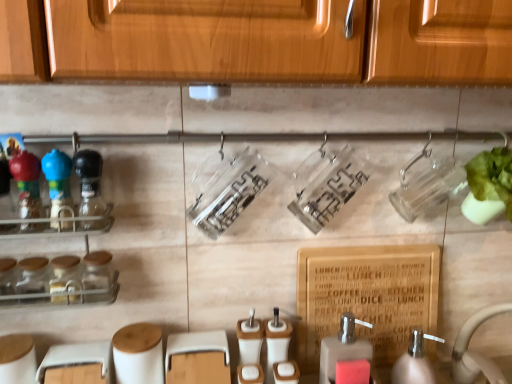
I want to click on matte brown soap dispenser at lower center, the 2th soap dispenser viewed from the right, so click(341, 346).

At what (x,y) coordinates should I click in order to perform the action: click on white plastic soap dispenser at lower right, arranged as the 1th soap dispenser when viewed from the right. Please return your answer as a coordinate pair (x, y). This screenshot has width=512, height=384. Looking at the image, I should click on (415, 361).

The height and width of the screenshot is (384, 512). What are the coordinates of `clear plastic container at center, which is counted as the 1th bottle, starting from the right` in the screenshot? It's located at (227, 190).

What do you see at coordinates (227, 190) in the screenshot?
I see `clear plastic container at center, marked as the 3th bottle in a left-to-right arrangement` at bounding box center [227, 190].

What are the coordinates of `blue glossy bottle at left, which is the 3th bottle in right-to-left order` in the screenshot? It's located at (58, 182).

At what (x,y) coordinates should I click in order to perform the action: click on matte black bottle at left, the 2th bottle when ordered from right to left. Please return your answer as a coordinate pair (x, y). Image resolution: width=512 pixels, height=384 pixels. Looking at the image, I should click on (89, 182).

You are a GUI agent. You are given a task and a screenshot of the screen. Output one action in this format:
    pyautogui.click(x=<x>, y=<y>)
    Task: Click on the green leafy vegetable at right
    The image size is (512, 384).
    Given the screenshot: What is the action you would take?
    pyautogui.click(x=489, y=185)

From a real-world perspective, is white plastic soap dispenser at lower right, which appears as the 2th soap dispenser when viewed from the left, on matte brown soap dispenser at lower center, the 2th soap dispenser viewed from the right?

No, from a real-world perspective, white plastic soap dispenser at lower right, which appears as the 2th soap dispenser when viewed from the left, is not on top of matte brown soap dispenser at lower center, the 2th soap dispenser viewed from the right.

You are a GUI agent. You are given a task and a screenshot of the screen. Output one action in this format:
    pyautogui.click(x=<x>, y=<y>)
    Task: Click on the soap dispenser that is above the white plastic soap dispenser at lower right, which appears as the 2th soap dispenser when viewed from the left (from the image's perspective)
    
    Given the screenshot: What is the action you would take?
    pyautogui.click(x=341, y=346)

How different are the orientations of white plastic soap dispenser at lower right, arranged as the 1th soap dispenser when viewed from the right, and matte brown soap dispenser at lower center, the 2th soap dispenser viewed from the right, in degrees?

The facing directions of white plastic soap dispenser at lower right, arranged as the 1th soap dispenser when viewed from the right, and matte brown soap dispenser at lower center, the 2th soap dispenser viewed from the right, are 0.00191 degrees apart.

Which of these two, white plastic soap dispenser at lower right, arranged as the 1th soap dispenser when viewed from the right, or matte brown soap dispenser at lower center, which is counted as the first soap dispenser, starting from the left, is smaller?

matte brown soap dispenser at lower center, which is counted as the first soap dispenser, starting from the left.

Which object is positioned more to the right, white plastic soap dispenser at lower right, which appears as the 2th soap dispenser when viewed from the left, or clear plastic container at center, marked as the 3th bottle in a left-to-right arrangement?

white plastic soap dispenser at lower right, which appears as the 2th soap dispenser when viewed from the left, is more to the right.

Considering the relative sizes of white plastic soap dispenser at lower right, arranged as the 1th soap dispenser when viewed from the right, and clear plastic container at center, which is counted as the 1th bottle, starting from the right, in the image provided, is white plastic soap dispenser at lower right, arranged as the 1th soap dispenser when viewed from the right, taller than clear plastic container at center, which is counted as the 1th bottle, starting from the right,?

In fact, white plastic soap dispenser at lower right, arranged as the 1th soap dispenser when viewed from the right, may be shorter than clear plastic container at center, which is counted as the 1th bottle, starting from the right.

Can you see white plastic soap dispenser at lower right, which appears as the 2th soap dispenser when viewed from the left, touching clear plastic container at center, which is counted as the 1th bottle, starting from the right?

No, white plastic soap dispenser at lower right, which appears as the 2th soap dispenser when viewed from the left, is not touching clear plastic container at center, which is counted as the 1th bottle, starting from the right.

Who is bigger, white plastic soap dispenser at lower right, which appears as the 2th soap dispenser when viewed from the left, or clear plastic container at center, which is counted as the 1th bottle, starting from the right?

Bigger between the two is clear plastic container at center, which is counted as the 1th bottle, starting from the right.

From the image's perspective, is green leafy vegetable at right above or below clear glass spice rack at left?

Based on their image positions, green leafy vegetable at right is located above clear glass spice rack at left.

Is clear glass spice rack at left a part of green leafy vegetable at right?

No, clear glass spice rack at left is not surrounded by green leafy vegetable at right.

Locate an element on the screen. The image size is (512, 384). shelf in front of the green leafy vegetable at right is located at coordinates (57, 235).

Who is shorter, green leafy vegetable at right or clear glass spice rack at left?

With less height is green leafy vegetable at right.

In the scene shown: Is white ceramic sink at lower right far away from matte brown soap dispenser at lower center, which is counted as the first soap dispenser, starting from the left?

No, there isn't a large distance between white ceramic sink at lower right and matte brown soap dispenser at lower center, which is counted as the first soap dispenser, starting from the left.

From a real-world perspective, does white ceramic sink at lower right sit lower than matte brown soap dispenser at lower center, the 2th soap dispenser viewed from the right?

Actually, white ceramic sink at lower right is physically above matte brown soap dispenser at lower center, the 2th soap dispenser viewed from the right, in the real world.

Measure the distance between white ceramic sink at lower right and matte brown soap dispenser at lower center, which is counted as the first soap dispenser, starting from the left.

white ceramic sink at lower right is 7.40 inches from matte brown soap dispenser at lower center, which is counted as the first soap dispenser, starting from the left.

What's the angular difference between white ceramic sink at lower right and matte brown soap dispenser at lower center, which is counted as the first soap dispenser, starting from the left,'s facing directions?

36.5 degrees.

From the image's perspective, count 1st bottles downward from the matte black bottle at left, the 2th bottle when ordered from right to left, and point to it. Please provide its 2D coordinates.

[(58, 182)]

Who is bigger, blue glossy bottle at left, which is the 1th bottle in left-to-right order, or matte black bottle at left, the 2th bottle when ordered from right to left?

blue glossy bottle at left, which is the 1th bottle in left-to-right order, is bigger.

Is point (53, 187) positioned behind point (93, 175)?

No, it is not.

From a real-world perspective, which object stands above the other?

green leafy vegetable at right.

Considering the relative sizes of green leafy vegetable at right and white ceramic sink at lower right in the image provided, is green leafy vegetable at right thinner than white ceramic sink at lower right?

Yes, green leafy vegetable at right is thinner than white ceramic sink at lower right.

Which point is more forward, (472, 202) or (421, 381)?

The point (472, 202) is more forward.

Is there a large distance between clear plastic container at center, which is counted as the 1th bottle, starting from the right, and blue glossy bottle at left, which is the 1th bottle in left-to-right order?

clear plastic container at center, which is counted as the 1th bottle, starting from the right, is actually quite close to blue glossy bottle at left, which is the 1th bottle in left-to-right order.

From a real-world perspective, is clear plastic container at center, which is counted as the 1th bottle, starting from the right, above or below blue glossy bottle at left, which is the 1th bottle in left-to-right order?

clear plastic container at center, which is counted as the 1th bottle, starting from the right, is below blue glossy bottle at left, which is the 1th bottle in left-to-right order.

Does clear plastic container at center, marked as the 3th bottle in a left-to-right arrangement, have a larger size compared to blue glossy bottle at left, which is the 3th bottle in right-to-left order?

Yes, clear plastic container at center, marked as the 3th bottle in a left-to-right arrangement, is bigger than blue glossy bottle at left, which is the 3th bottle in right-to-left order.

Locate an element on the screen. This screenshot has height=384, width=512. soap dispenser on the right of matte brown soap dispenser at lower center, which is counted as the first soap dispenser, starting from the left is located at coordinates (415, 361).

There is a white plastic soap dispenser at lower right, which appears as the 2th soap dispenser when viewed from the left. In order to click on the 1st bottle above it (from the image's perspective) in this screenshot , I will do `click(227, 190)`.

Considering their positions, is clear plastic container at center, which is counted as the 1th bottle, starting from the right, positioned further to white ceramic sink at lower right than green leafy vegetable at right?

The object further to white ceramic sink at lower right is clear plastic container at center, which is counted as the 1th bottle, starting from the right.

Which object lies nearer to the anchor point clear plastic container at center, marked as the 3th bottle in a left-to-right arrangement, white ceramic sink at lower right or clear glass spice rack at left?

clear glass spice rack at left.

Considering their positions, is clear plastic container at center, which is counted as the 1th bottle, starting from the right, positioned closer to matte brown soap dispenser at lower center, which is counted as the first soap dispenser, starting from the left, than clear glass spice rack at left?

Among the two, clear plastic container at center, which is counted as the 1th bottle, starting from the right, is located nearer to matte brown soap dispenser at lower center, which is counted as the first soap dispenser, starting from the left.

Based on their spatial positions, is clear glass spice rack at left or white ceramic sink at lower right closer to white plastic soap dispenser at lower right, which appears as the 2th soap dispenser when viewed from the left?

white ceramic sink at lower right is closer to white plastic soap dispenser at lower right, which appears as the 2th soap dispenser when viewed from the left.

Looking at the image, which one is located further to matte brown soap dispenser at lower center, the 2th soap dispenser viewed from the right, white plastic soap dispenser at lower right, which appears as the 2th soap dispenser when viewed from the left, or matte black bottle at left, which is the second bottle in left-to-right order?

matte black bottle at left, which is the second bottle in left-to-right order.

Which object lies nearer to the anchor point clear glass spice rack at left, white plastic soap dispenser at lower right, arranged as the 1th soap dispenser when viewed from the right, or white ceramic sink at lower right?

white plastic soap dispenser at lower right, arranged as the 1th soap dispenser when viewed from the right.

Consider the image. Based on their spatial positions, is white plastic soap dispenser at lower right, which appears as the 2th soap dispenser when viewed from the left, or green leafy vegetable at right closer to clear plastic container at center, marked as the 3th bottle in a left-to-right arrangement?

green leafy vegetable at right lies closer to clear plastic container at center, marked as the 3th bottle in a left-to-right arrangement, than the other object.

Based on their spatial positions, is clear glass spice rack at left or white plastic soap dispenser at lower right, which appears as the 2th soap dispenser when viewed from the left, closer to matte black bottle at left, the 2th bottle when ordered from right to left?

The object closer to matte black bottle at left, the 2th bottle when ordered from right to left, is clear glass spice rack at left.

The height and width of the screenshot is (384, 512). What are the coordinates of `bottle situated between matte black bottle at left, which is the second bottle in left-to-right order, and matte brown soap dispenser at lower center, which is counted as the first soap dispenser, starting from the left, from left to right` in the screenshot? It's located at 227,190.

Where is `bottle situated between matte black bottle at left, which is the second bottle in left-to-right order, and white ceramic sink at lower right from left to right`? Image resolution: width=512 pixels, height=384 pixels. bottle situated between matte black bottle at left, which is the second bottle in left-to-right order, and white ceramic sink at lower right from left to right is located at coordinates point(227,190).

Find the location of `soap dispenser between clear glass spice rack at left and white plastic soap dispenser at lower right, arranged as the 1th soap dispenser when viewed from the right`. soap dispenser between clear glass spice rack at left and white plastic soap dispenser at lower right, arranged as the 1th soap dispenser when viewed from the right is located at coordinates (341, 346).

Where is `soap dispenser between clear plastic container at center, marked as the 3th bottle in a left-to-right arrangement, and white plastic soap dispenser at lower right, arranged as the 1th soap dispenser when viewed from the right, in the vertical direction`? soap dispenser between clear plastic container at center, marked as the 3th bottle in a left-to-right arrangement, and white plastic soap dispenser at lower right, arranged as the 1th soap dispenser when viewed from the right, in the vertical direction is located at coordinates (341, 346).